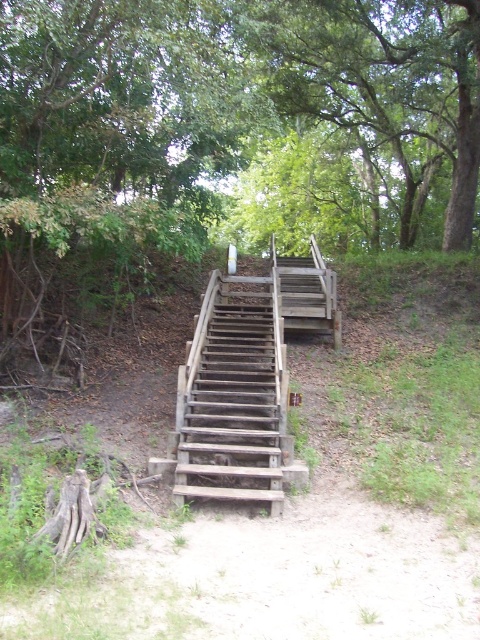
You are standing at the bottom of the rustic wooden staircase and want to reach the top. You notice two points marked on the staircase, point (346, 77) and point (264, 385). Which point is closer to you as you look up the staircase?

Point (264, 385) is closer to you because it is less further to the camera than point (346, 77), which is further away.

You are a hiker carrying a backpack weighing 10 kilograms. You want to climb the weathered wood stairs at center to reach the green leafy tree at center. Given that the stairs are 4.97 meters away from the tree, can you estimate the time it would take to climb the stairs and reach the tree?

The distance between the weathered wood stairs at center and the green leafy tree at center is 4.97 meters. However, the time required to climb the stairs depends on factors like your physical condition, the steepness of the slope, and the stability of the stairs, which are not provided. Therefore, an exact time cannot be determined.